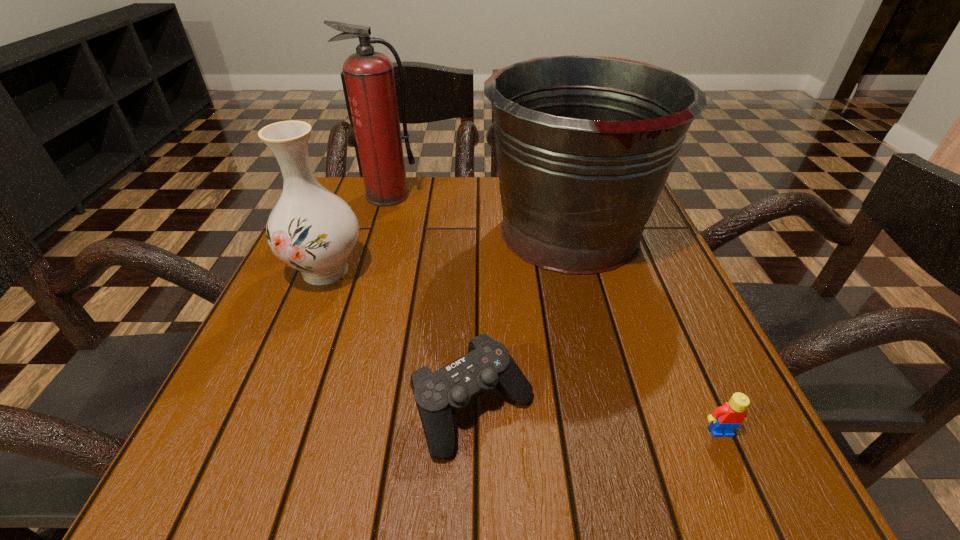
Where is `fire extinguisher`? fire extinguisher is located at coordinates (369, 76).

Find the location of a particular element. bucket is located at coordinates (584, 143).

Locate an element on the screen. This screenshot has height=540, width=960. vase is located at coordinates (310, 229).

This screenshot has width=960, height=540. Find the location of `Lego`. Lego is located at coordinates (725, 418).

You are a GUI agent. You are given a task and a screenshot of the screen. Output one action in this format:
    pyautogui.click(x=<x>, y=<y>)
    Task: Click on the control
    This screenshot has width=960, height=540.
    Given the screenshot: What is the action you would take?
    (488, 365)

At what (x,y) coordinates should I click in order to perform the action: click on free space located at the nozzle of the fire extinguisher. Please return your answer as a coordinate pair (x, y). The image size is (960, 540). Looking at the image, I should click on (356, 303).

Identify the location of vacant space situated 0.310m on the front of the bucket. (622, 430).

The height and width of the screenshot is (540, 960). In order to click on vacant space located 0.260m on the back of the vase in this screenshot , I will do `click(359, 188)`.

Identify the location of vacant position located on the face of the Lego. The width and height of the screenshot is (960, 540). (749, 495).

You are a GUI agent. You are given a task and a screenshot of the screen. Output one action in this format:
    pyautogui.click(x=<x>, y=<y>)
    Task: Click on the blank area located 0.190m on the right of the control
    This screenshot has height=540, width=960.
    Given the screenshot: What is the action you would take?
    pyautogui.click(x=657, y=409)